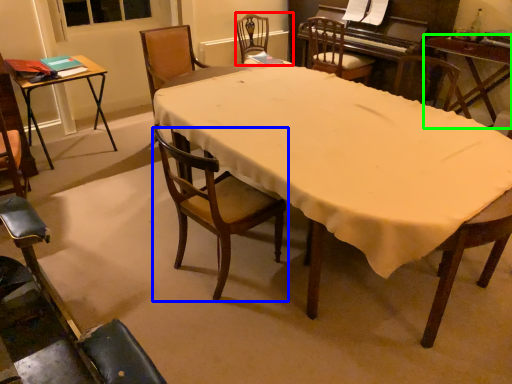
Question: Considering the real-world distances, which object is closest to chair (highlighted by a red box)? chair (highlighted by a blue box) or table (highlighted by a green box).

Choices:
 (A) chair
 (B) table

Answer: (B)